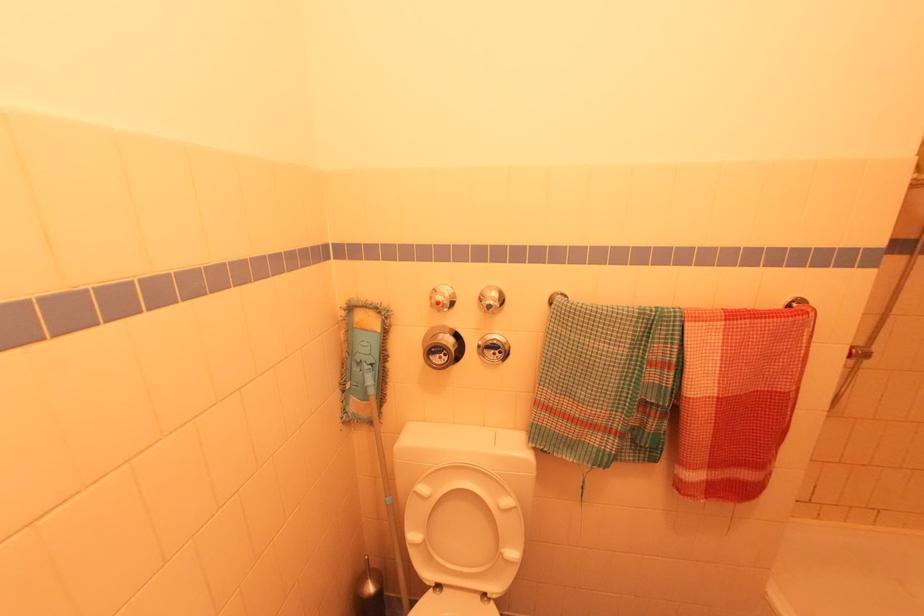
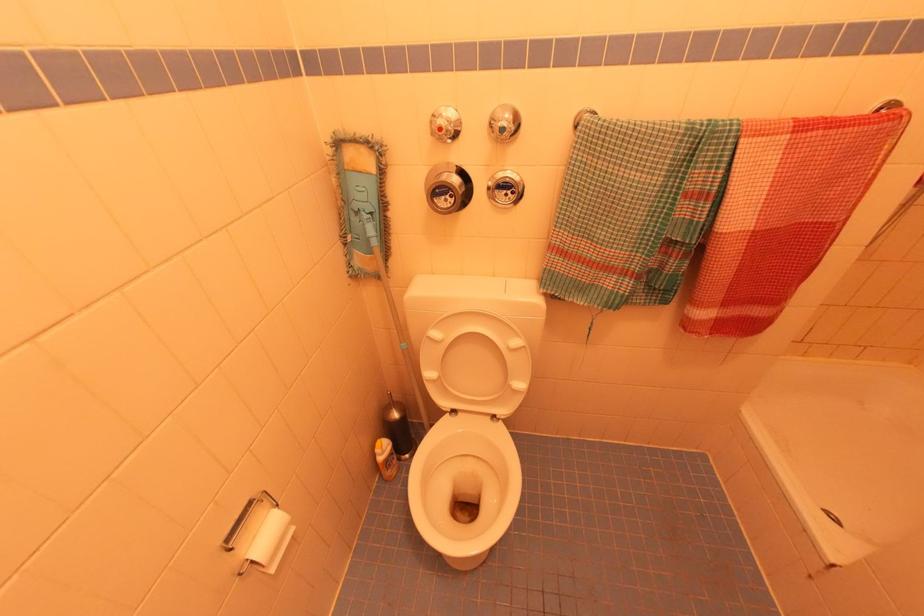
Where in the second image is the point corresponding to (x=446, y=299) from the first image?

(450, 123)